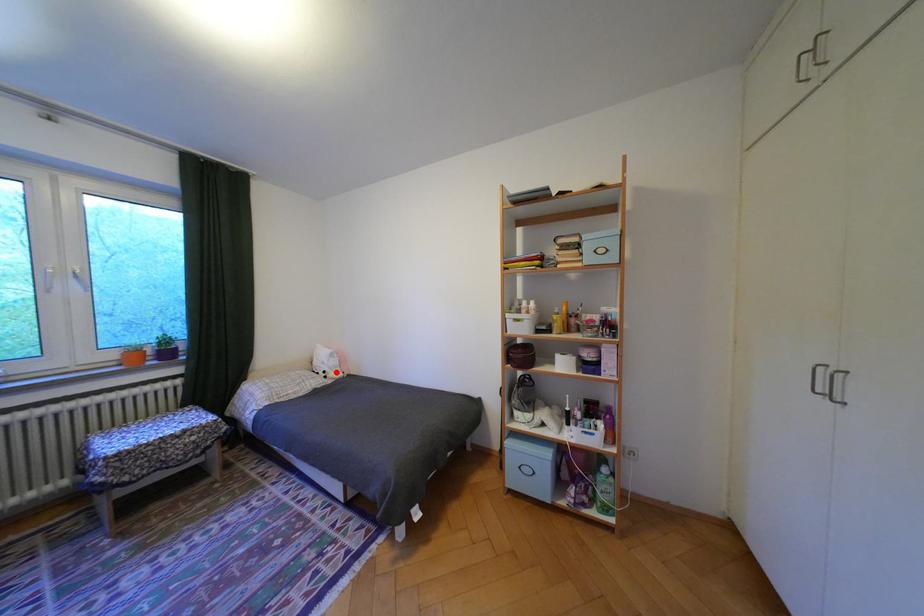
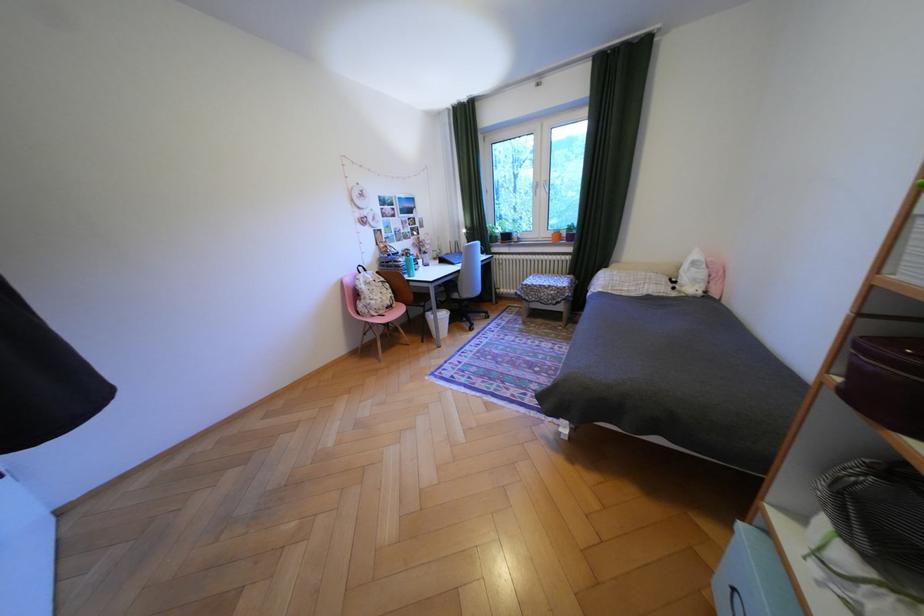
Question: I am providing you with two images of the same scene from different viewpoints. Image1 has a red point marked. In image2, the corresponding 3D location appears at what relative position? Reply with the corresponding letter.

Choices:
 (A) Closer
 (B) Farther

Answer: (B)